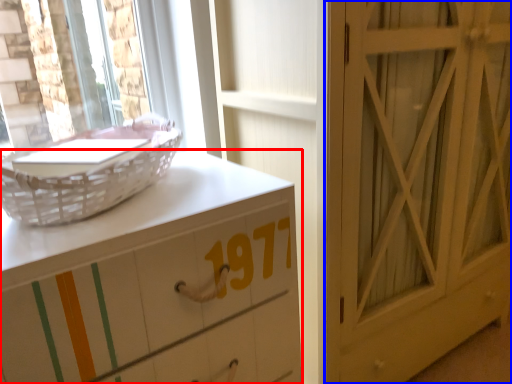
Question: Among these objects, which one is nearest to the camera, chest of drawers (highlighted by a red box) or door (highlighted by a blue box)?

Choices:
 (A) chest of drawers
 (B) door

Answer: (A)